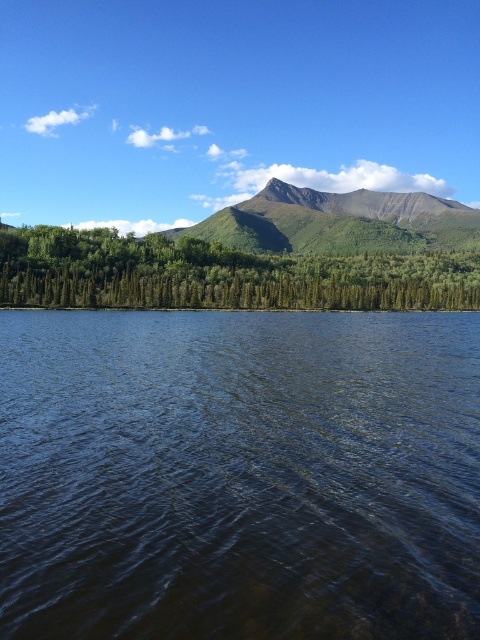
Does dark blue water at center appear on the left side of green matte trees at center?

Indeed, dark blue water at center is positioned on the left side of green matte trees at center.

Does dark blue water at center appear on the right side of green matte trees at center?

In fact, dark blue water at center is to the left of green matte trees at center.

At what (x,y) coordinates should I click in order to perform the action: click on dark blue water at center. Please return your answer as a coordinate pair (x, y). Looking at the image, I should click on (239, 474).

Who is positioned more to the left, green matte trees at center or green textured mountain at center?

Positioned to the left is green matte trees at center.

Between green matte trees at center and green textured mountain at center, which one appears on the right side from the viewer's perspective?

From the viewer's perspective, green textured mountain at center appears more on the right side.

From the picture: Who is more distant from viewer, (x=7, y=276) or (x=310, y=250)?

Point (x=310, y=250)

Locate an element on the screen. The height and width of the screenshot is (640, 480). green matte trees at center is located at coordinates (219, 275).

Is dark blue water at center thinner than green textured mountain at center?

Correct, dark blue water at center's width is less than green textured mountain at center's.

What are the coordinates of `dark blue water at center` in the screenshot? It's located at (239, 474).

The height and width of the screenshot is (640, 480). I want to click on dark blue water at center, so click(x=239, y=474).